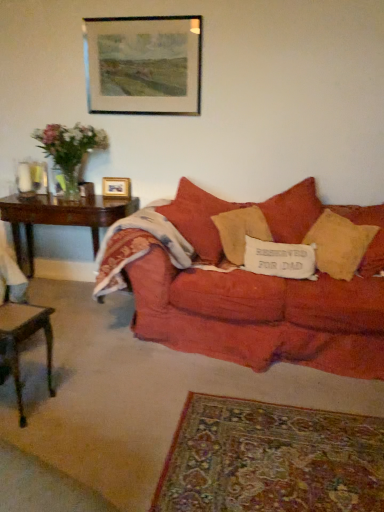
Question: From their relative heights in the image, would you say wooden picture frame at upper center, the first picture frame when ordered from top to bottom, is taller or shorter than matte red couch at center?

Choices:
 (A) tall
 (B) short

Answer: (B)

Question: Is wooden picture frame at upper center, the 2th picture frame when ordered from bottom to top, to the left or to the right of matte red couch at center in the image?

Choices:
 (A) left
 (B) right

Answer: (A)

Question: Estimate the real-world distances between objects in this image. Which object is closer to the matte red couch at center?

Choices:
 (A) textured beige pillow at center, which appears as the second pillow when viewed from the left
 (B) white fabric pillow at center, the first pillow from the left
 (C) translucent glass vase at left
 (D) clear glass vase at left
 (E) wooden picture frame at upper center, the first picture frame in the bottom-to-top sequence

Answer: (B)

Question: Which object is the closest to the clear glass vase at left?

Choices:
 (A) white fabric pillow at center, the 3th pillow positioned from the right
 (B) textured beige pillow at center, placed as the 2th pillow when sorted from right to left
 (C) dark wood table at left, the 1th table positioned from the back
 (D) matte red couch at center
 (E) wooden picture frame at upper center, the 2th picture frame when ordered from bottom to top

Answer: (C)